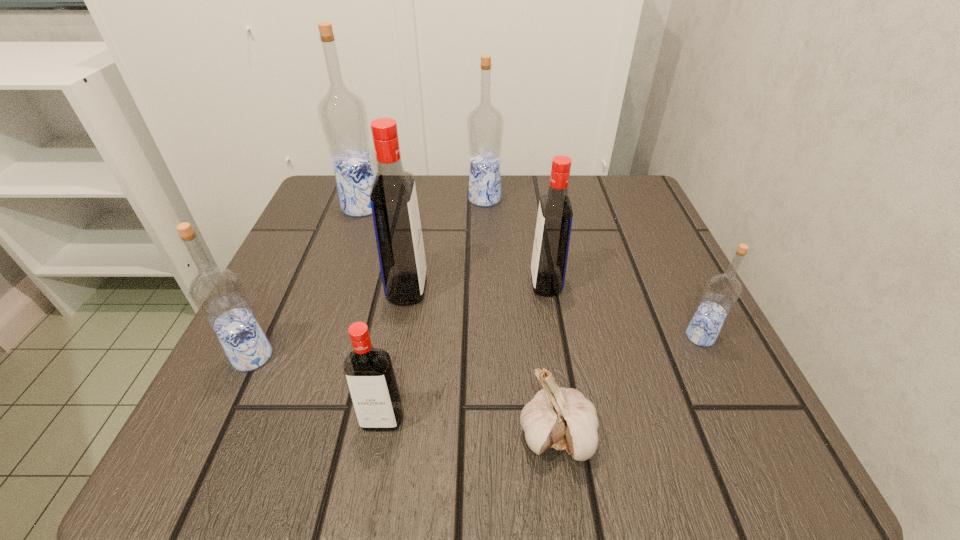
You are a GUI agent. You are given a task and a screenshot of the screen. Output one action in this format:
    pyautogui.click(x=<x>, y=<y>)
    Task: Click on the free location located 0.120m on the right of the leftmost object
    This screenshot has height=540, width=960.
    Given the screenshot: What is the action you would take?
    pyautogui.click(x=352, y=356)

Find the location of a particular element. This screenshot has width=960, height=540. vacant area located 0.050m on the front and back of the nearest red vodka is located at coordinates (372, 472).

The image size is (960, 540). Find the location of `vacant space located on the back of the rightmost vodka`. vacant space located on the back of the rightmost vodka is located at coordinates 658,248.

Locate an element on the screen. This screenshot has height=540, width=960. vacant space situated 0.390m on the back of the shortest object is located at coordinates (529, 234).

This screenshot has height=540, width=960. In order to click on vodka present at the near edge in this screenshot , I will do `click(369, 373)`.

What are the coordinates of `garlic that is at the near edge` in the screenshot? It's located at point(562,418).

The width and height of the screenshot is (960, 540). Identify the location of object located in the right edge section of the desktop. (722, 291).

Locate an element on the screen. object at the far left corner is located at coordinates (342, 114).

In the image, there is a desktop. Find the location of `free region at the far edge`. free region at the far edge is located at coordinates (445, 196).

The width and height of the screenshot is (960, 540). What are the coordinates of `vacant space at the near edge of the desktop` in the screenshot? It's located at (516, 420).